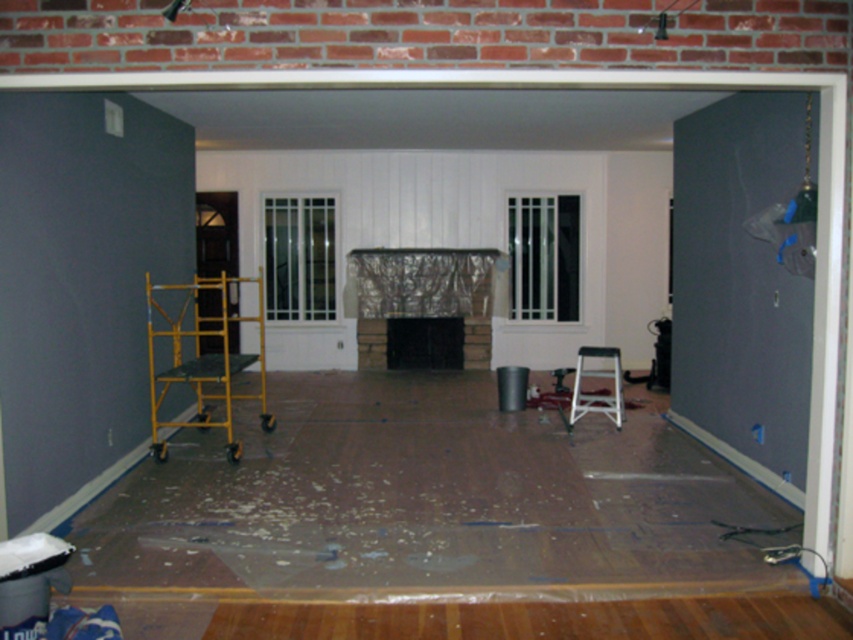
Question: Can you confirm if yellow metal scaffolding at left is thinner than white plastic stool at center?

Choices:
 (A) yes
 (B) no

Answer: (B)

Question: Considering the relative positions of matte gray door at right and yellow metal scaffolding at left in the image provided, where is matte gray door at right located with respect to yellow metal scaffolding at left?

Choices:
 (A) left
 (B) right

Answer: (B)

Question: Estimate the real-world distances between objects in this image. Which object is farther from the yellow metal scaffolding at left?

Choices:
 (A) matte gray door at right
 (B) white plastic stool at center

Answer: (B)

Question: Which object is positioned closest to the yellow metal scaffolding at left?

Choices:
 (A) white plastic stool at center
 (B) matte gray door at right

Answer: (B)

Question: Can you confirm if matte gray door at right is smaller than yellow metal scaffolding at left?

Choices:
 (A) no
 (B) yes

Answer: (B)

Question: Considering the real-world distances, which object is farthest from the yellow metal scaffolding at left?

Choices:
 (A) white plastic stool at center
 (B) matte gray door at right

Answer: (A)